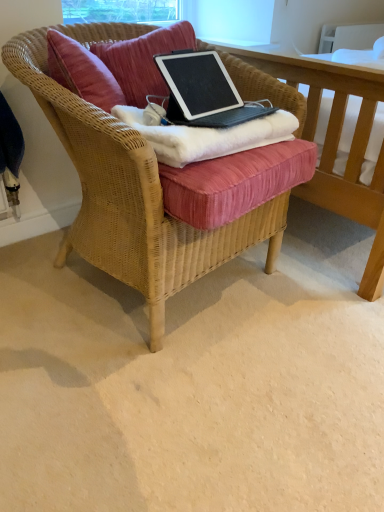
Question: Is the position of velvet cushion at center more distant than that of black matte laptop at center?

Choices:
 (A) yes
 (B) no

Answer: (A)

Question: Is velvet cushion at center beside black matte laptop at center?

Choices:
 (A) no
 (B) yes

Answer: (A)

Question: From the image's perspective, would you say velvet cushion at center is positioned over black matte laptop at center?

Choices:
 (A) yes
 (B) no

Answer: (A)

Question: Considering the relative positions of velvet cushion at center and black matte laptop at center in the image provided, is velvet cushion at center to the left of black matte laptop at center from the viewer's perspective?

Choices:
 (A) no
 (B) yes

Answer: (B)

Question: Considering the relative sizes of velvet cushion at center and black matte laptop at center in the image provided, is velvet cushion at center bigger than black matte laptop at center?

Choices:
 (A) no
 (B) yes

Answer: (B)

Question: Would you say velvet cushion at center is outside black matte laptop at center?

Choices:
 (A) no
 (B) yes

Answer: (B)

Question: Is white fluffy blanket at center surrounding black matte laptop at center?

Choices:
 (A) yes
 (B) no

Answer: (B)

Question: Is black matte laptop at center at the back of white fluffy blanket at center?

Choices:
 (A) no
 (B) yes

Answer: (A)

Question: Does white fluffy blanket at center have a smaller size compared to black matte laptop at center?

Choices:
 (A) no
 (B) yes

Answer: (A)

Question: From a real-world perspective, does white fluffy blanket at center stand above black matte laptop at center?

Choices:
 (A) yes
 (B) no

Answer: (B)

Question: Is white fluffy blanket at center taller than black matte laptop at center?

Choices:
 (A) yes
 (B) no

Answer: (B)

Question: Is white fluffy blanket at center aimed at black matte laptop at center?

Choices:
 (A) yes
 (B) no

Answer: (B)

Question: Is black matte laptop at center positioned in front of velvet cushion at center?

Choices:
 (A) no
 (B) yes

Answer: (B)